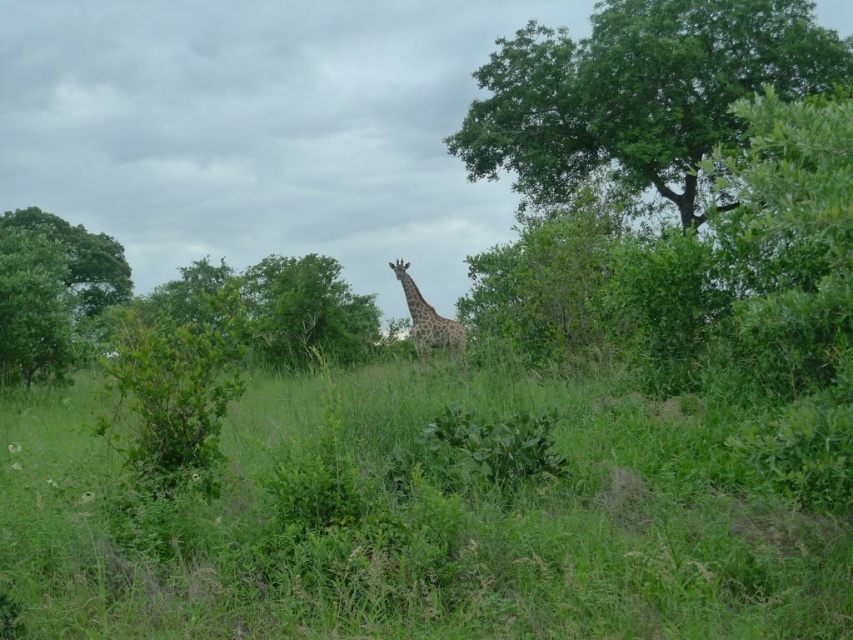
Can you confirm if green leafy tree at upper right is taller than green leafy tree at center?

Yes.

Can you confirm if green leafy tree at upper right is positioned above green leafy tree at center?

Indeed, green leafy tree at upper right is positioned over green leafy tree at center.

At what (x,y) coordinates should I click in order to perform the action: click on green leafy tree at upper right. Please return your answer as a coordinate pair (x, y). The image size is (853, 640). Looking at the image, I should click on (639, 92).

Does point (10, 269) lie in front of point (440, 326)?

No, (10, 269) is further to viewer.

Where is `green leafy tree at left`? This screenshot has height=640, width=853. green leafy tree at left is located at coordinates (51, 291).

Find the location of a particular element. This screenshot has height=640, width=853. green leafy tree at left is located at coordinates (51, 291).

Which of these two, green leafy tree at center or spotted fur giraffe at center, stands taller?

With more height is green leafy tree at center.

Identify the location of green leafy tree at center. This screenshot has height=640, width=853. (306, 310).